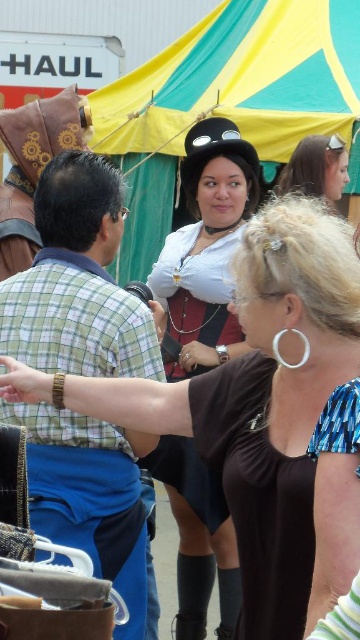
You are an event organizer at the festival and need to arrange a photo shoot. You have a backdrop that is 1.2 meters wide. The green plaid shirt at left and the matte black hat at upper center are part of the setup. Which object should be placed first on the backdrop to ensure both can fit side by side?

The green plaid shirt at left has a lesser width compared to matte black hat at upper center, so place the green plaid shirt at left first to accommodate the wider matte black hat at upper center on the remaining space.

Where is the matte black hat at center located in the image?

The matte black hat at center is located at the point with coordinates 0.391 on the x axis and 0.572 on the y axis.

Consider the image. You are a photographer at the festival and want to take a photo of the green plaid shirt at left and the matte black hat at upper center. Can you see both objects clearly in the same frame without any obstruction?

The green plaid shirt at left is in front of the matte black hat at upper center, so the matte black hat at upper center may be partially obscured by the green plaid shirt at left in the photo.